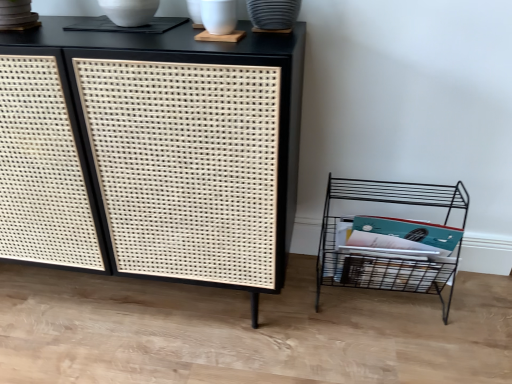
At what (x,y) coordinates should I click in order to perform the action: click on vacant area that lies between black woven cabinet at center and black wire shelf at lower right. Please return your answer as a coordinate pair (x, y). Looking at the image, I should click on (337, 318).